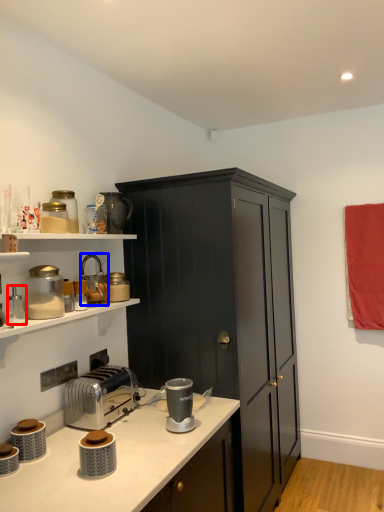
Question: Which object appears farthest to the camera in this image, appliance (highlighted by a red box) or appliance (highlighted by a blue box)?

Choices:
 (A) appliance
 (B) appliance

Answer: (B)